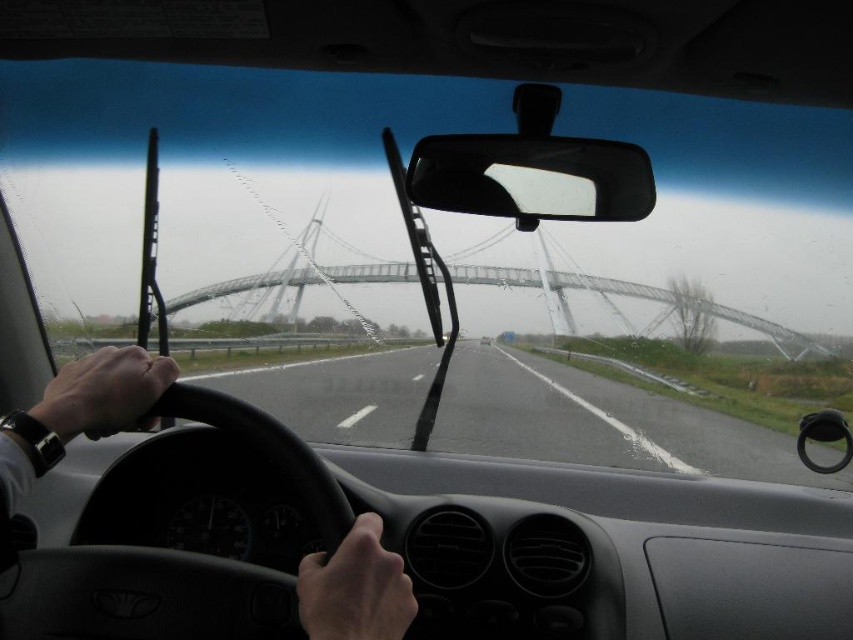
The height and width of the screenshot is (640, 853). Identify the location of black leather steering wheel at center. (355, 588).

Which is in front, point (329, 589) or point (611, 289)?

Positioned in front is point (329, 589).

Identify the location of black leather steering wheel at center. The height and width of the screenshot is (640, 853). (355, 588).

Consider the image. Who is lower down, asphalt road at center or black leather steering wheel at center?

asphalt road at center is lower down.

Does asphalt road at center appear on the left side of black leather steering wheel at center?

Incorrect, asphalt road at center is not on the left side of black leather steering wheel at center.

Locate an element on the screen. The height and width of the screenshot is (640, 853). asphalt road at center is located at coordinates (601, 422).

Who is positioned more to the left, asphalt road at center or transparent glass bridge at center?

asphalt road at center is more to the left.

Is point (520, 380) positioned in front of point (695, 301)?

That is False.

Where is `asphalt road at center`? This screenshot has height=640, width=853. asphalt road at center is located at coordinates (601, 422).